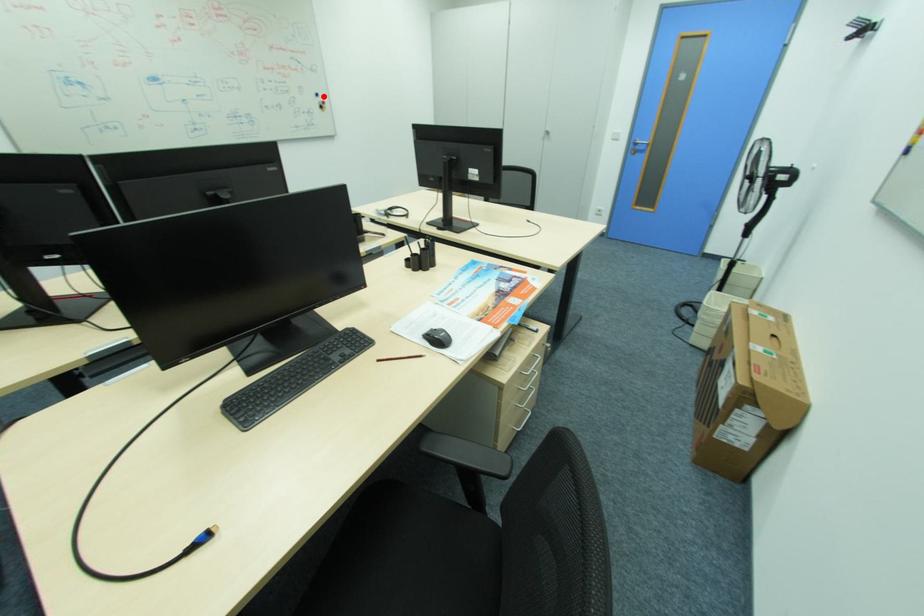
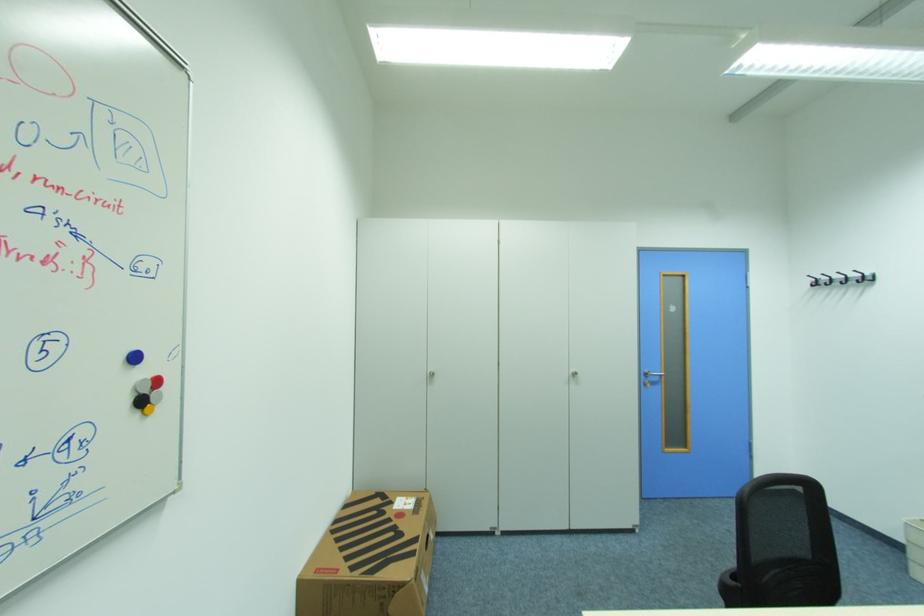
Where in the second image is the point corresponding to the highlighted location from the first image?

(140, 359)